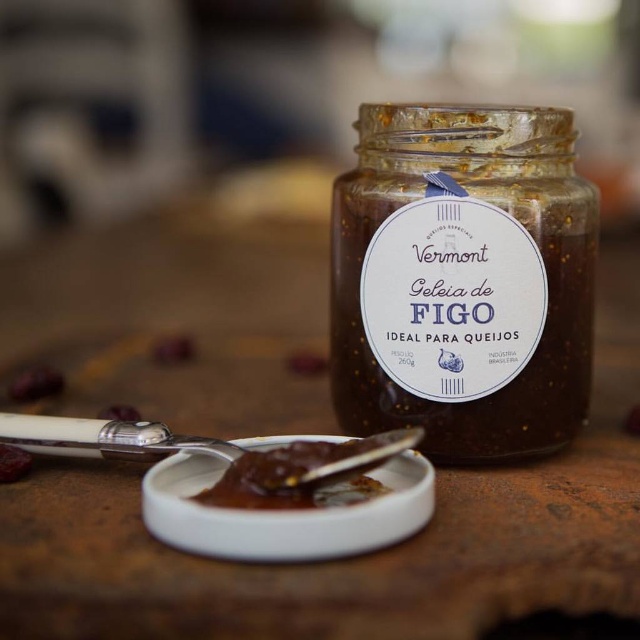
Question: Which of the following is the closest to the observer?

Choices:
 (A) (294, 458)
 (B) (342, 246)
 (C) (32, 369)

Answer: (A)

Question: Is transparent glass jar at center positioned at the back of brown gelatinous substance at center?

Choices:
 (A) yes
 (B) no

Answer: (A)

Question: Does transparent glass jar at center have a lesser width compared to brown matte fig jam at center?

Choices:
 (A) no
 (B) yes

Answer: (A)

Question: Among these objects, which one is nearest to the camera?

Choices:
 (A) transparent glass jar at center
 (B) white ceramic spoon at lower center
 (C) brown gelatinous substance at center

Answer: (B)

Question: Estimate the real-world distances between objects in this image. Which object is closer to the brown matte fig jam at center?

Choices:
 (A) white ceramic spoon at lower center
 (B) brown gelatinous substance at center
 (C) transparent glass jar at center

Answer: (A)

Question: Is transparent glass jar at center above brown gelatinous substance at center?

Choices:
 (A) no
 (B) yes

Answer: (B)